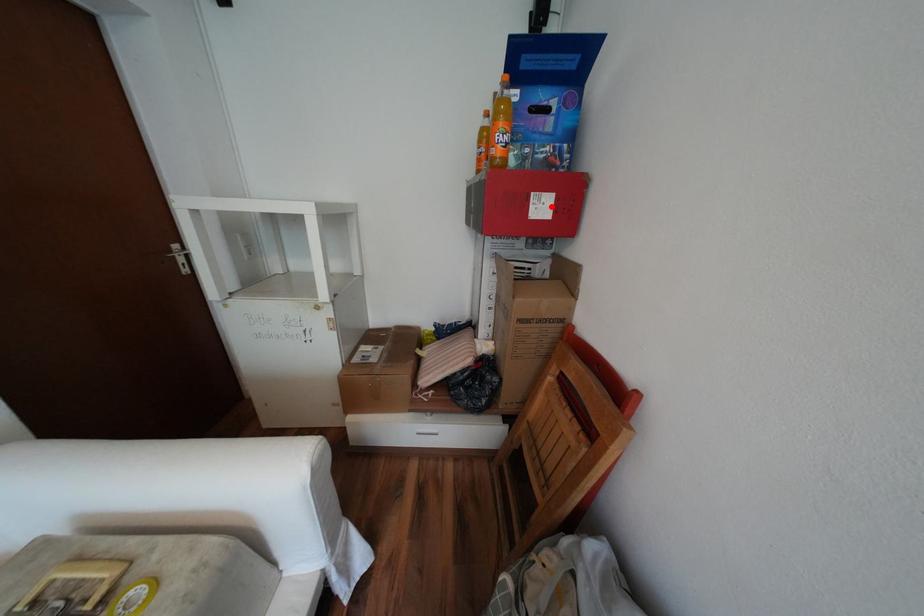
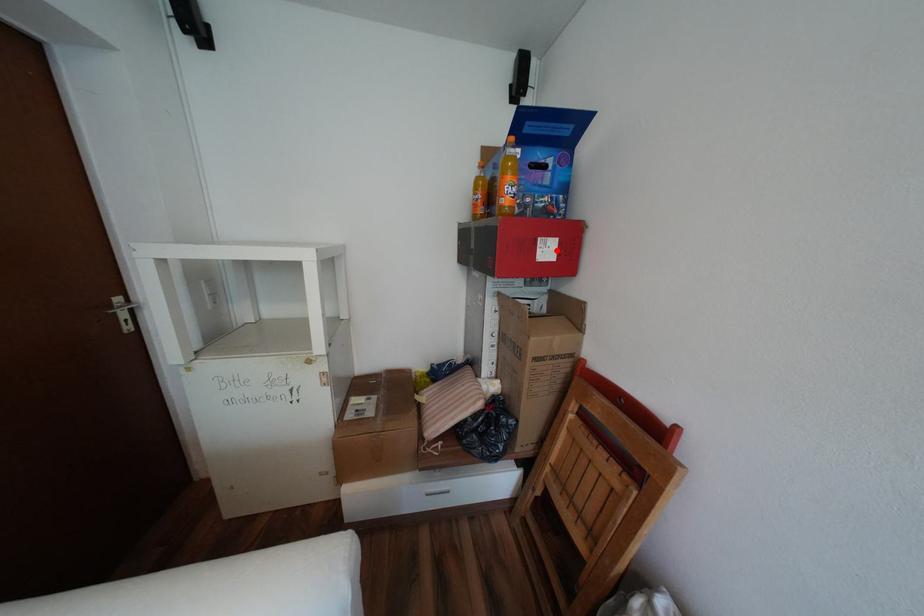
I am providing you with two images of the same scene from different viewpoints. A red point is marked on the first image and another point is marked on the second image. Is the red point in image1 aligned with the point shown in image2?

Yes